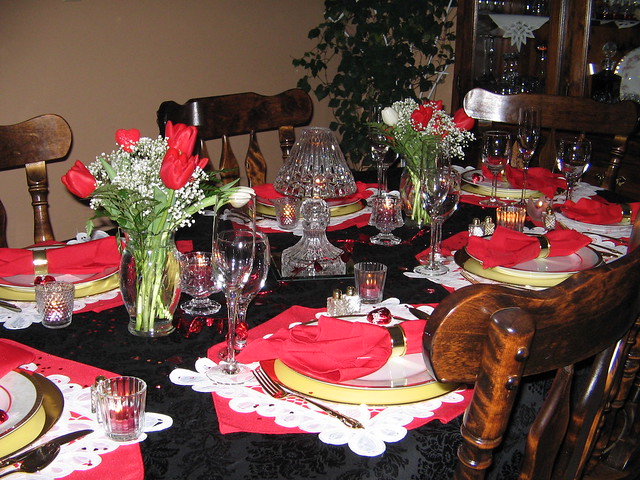
At what (x,y) coordinates should I click in order to perform the action: click on candles. Please return your answer as a coordinate pair (x, y). The height and width of the screenshot is (480, 640). Looking at the image, I should click on (51, 302), (383, 281), (390, 201), (539, 206), (200, 259).